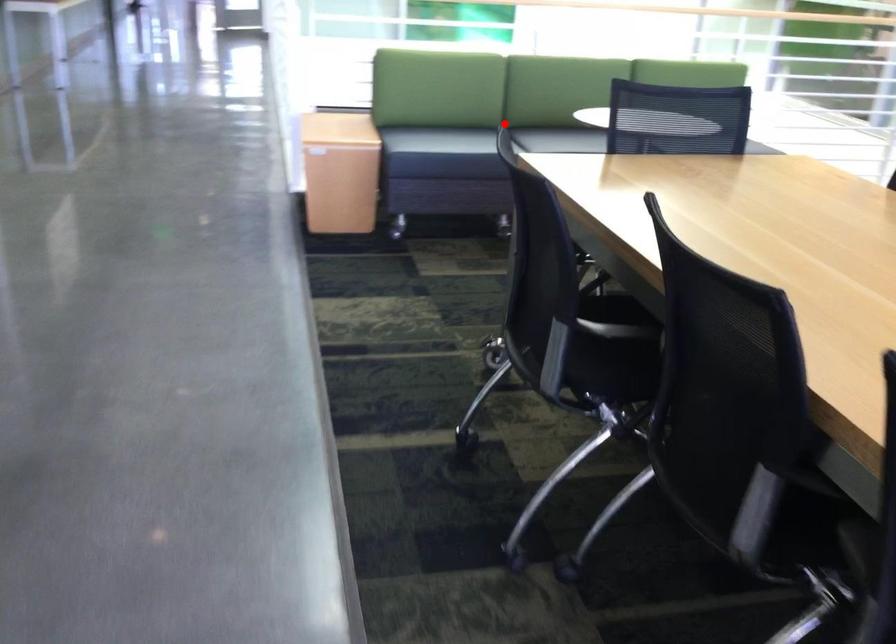
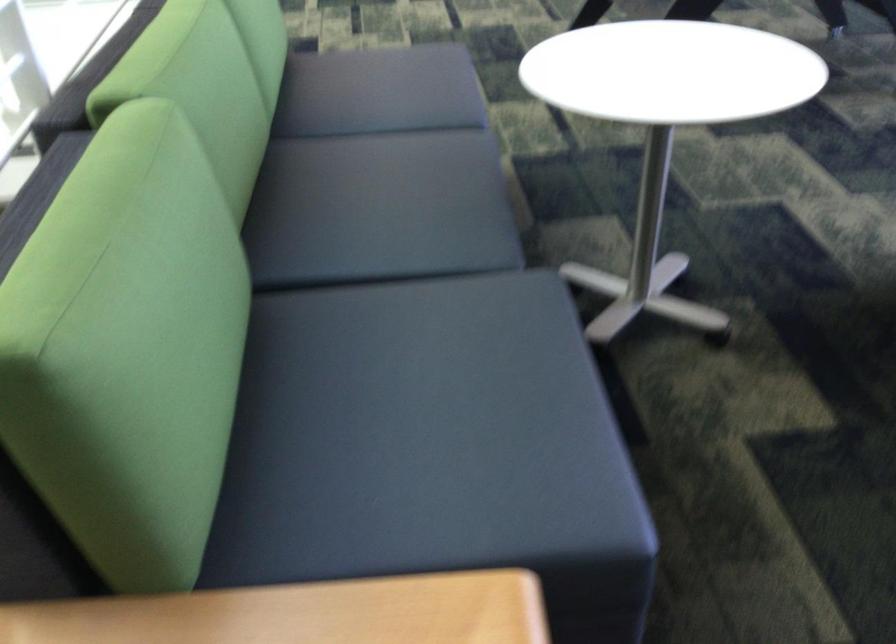
Find the pixel in the second image that matches the highlighted location in the first image.

(380, 210)